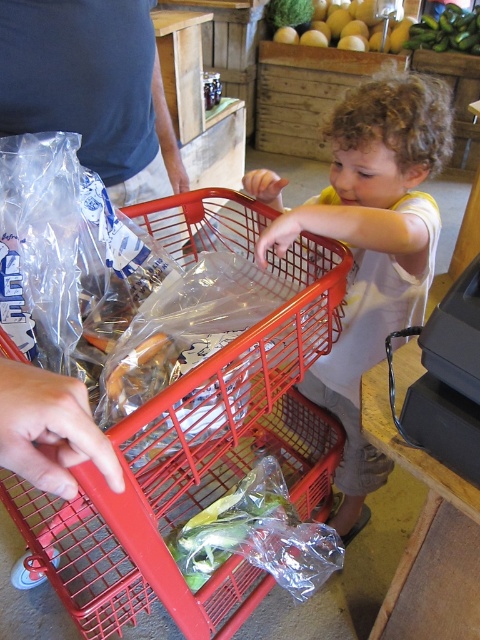
Is red plastic shopping cart at center smaller than curly-haired toddler at center?

No, red plastic shopping cart at center is not smaller than curly-haired toddler at center.

Can you confirm if red plastic shopping cart at center is positioned to the right of curly-haired toddler at center?

Incorrect, red plastic shopping cart at center is not on the right side of curly-haired toddler at center.

Is point (148, 205) closer to viewer compared to point (321, 372)?

Yes, it is in front of point (321, 372).

In order to click on red plastic shopping cart at center in this screenshot , I will do `click(195, 474)`.

Is curly-haired toddler at center closer to camera compared to green matte zucchini at upper right?

Yes, it is.

Can you confirm if curly-haired toddler at center is wider than green matte zucchini at upper right?

In fact, curly-haired toddler at center might be narrower than green matte zucchini at upper right.

At what (x,y) coordinates should I click in order to perform the action: click on curly-haired toddler at center. Please return your answer as a coordinate pair (x, y). This screenshot has width=480, height=640. Looking at the image, I should click on (372, 250).

Where is `curly-haired toddler at center`? This screenshot has height=640, width=480. curly-haired toddler at center is located at coordinates (372, 250).

Between yellow smooth melon at center and green matte zucchini at upper right, which one is positioned lower?

green matte zucchini at upper right is below.

Can you confirm if yellow smooth melon at center is positioned to the left of green matte zucchini at upper right?

Yes, yellow smooth melon at center is to the left of green matte zucchini at upper right.

Measure the distance between yellow smooth melon at center and camera.

A distance of 3.50 meters exists between yellow smooth melon at center and camera.

The width and height of the screenshot is (480, 640). I want to click on yellow smooth melon at center, so click(x=355, y=26).